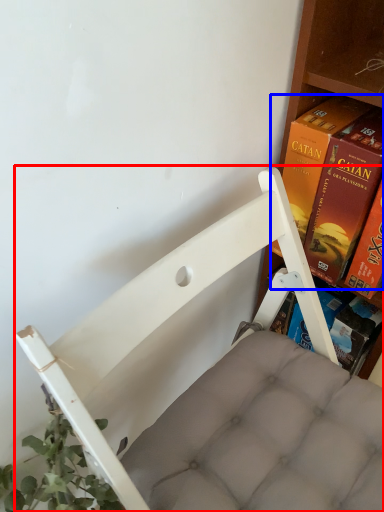
Question: Which point is closer to the camera, furniture (highlighted by a red box) or book (highlighted by a blue box)?

Choices:
 (A) furniture
 (B) book

Answer: (A)